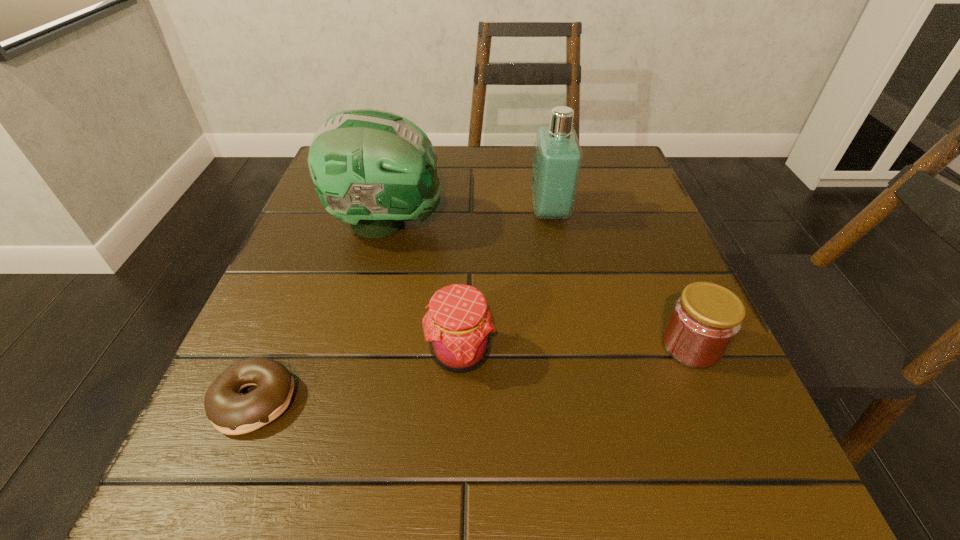
Where is `football helmet`? This screenshot has width=960, height=540. football helmet is located at coordinates (373, 169).

In order to click on the fourth object from left to right in this screenshot , I will do `click(557, 161)`.

Find the location of a particular element. This screenshot has width=960, height=540. the left jam is located at coordinates (458, 327).

What are the coordinates of `the right jam` in the screenshot? It's located at (705, 319).

Where is `the shortest object`? the shortest object is located at coordinates (230, 412).

Where is `free space located 0.130m on the visor of the football helmet`? The width and height of the screenshot is (960, 540). free space located 0.130m on the visor of the football helmet is located at coordinates (512, 223).

You are a GUI agent. You are given a task and a screenshot of the screen. Output one action in this format:
    pyautogui.click(x=<x>, y=<y>)
    Task: Click on the vacant space located 0.380m on the front label of the fourth object from left to right
    The image size is (960, 540).
    Given the screenshot: What is the action you would take?
    pyautogui.click(x=340, y=212)

Locate an element on the screen. Image resolution: width=960 pixels, height=540 pixels. vacant space located 0.380m on the front label of the fourth object from left to right is located at coordinates (340, 212).

This screenshot has height=540, width=960. What are the coordinates of `vacant space located 0.320m on the front label of the fourth object from left to right` in the screenshot? It's located at (371, 212).

Where is `vacant space situated on the left of the left jam`? This screenshot has width=960, height=540. vacant space situated on the left of the left jam is located at coordinates (257, 353).